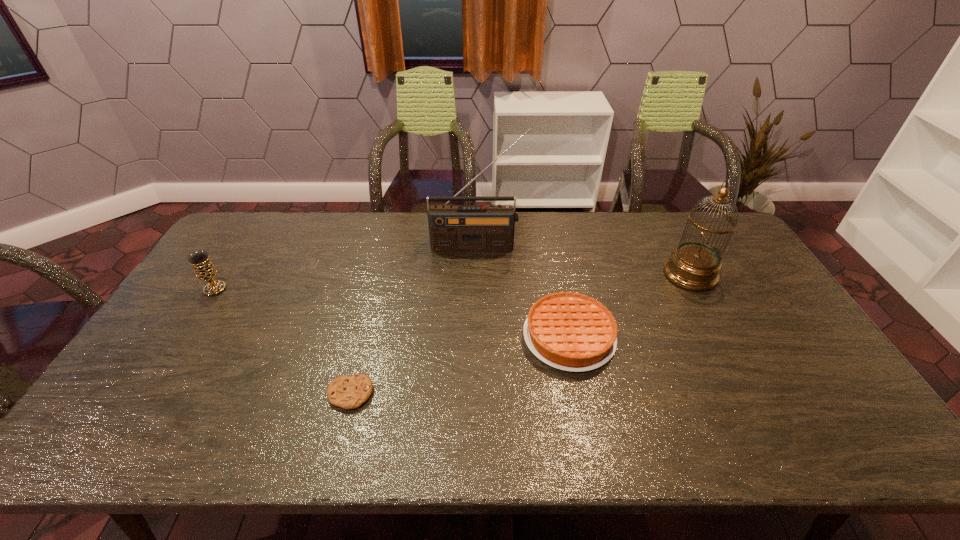
Locate an element on the screen. free space between the third shortest object and the second nearest object is located at coordinates (392, 313).

You are a GUI agent. You are given a task and a screenshot of the screen. Output one action in this format:
    pyautogui.click(x=<x>, y=<y>)
    Task: Click on the free spot between the fourth farthest object and the nearest object
    The width and height of the screenshot is (960, 540).
    Given the screenshot: What is the action you would take?
    pyautogui.click(x=460, y=365)

The image size is (960, 540). I want to click on unoccupied area between the leftmost object and the radio receiver, so click(x=346, y=268).

Locate an element on the screen. empty space between the cookie and the farthest object is located at coordinates (414, 320).

Find the location of a particular element. The width and height of the screenshot is (960, 540). object that ranks as the second closest to the fourth tallest object is located at coordinates (490, 228).

Locate an element on the screen. object that can be found as the third closest to the nearest object is located at coordinates (490, 228).